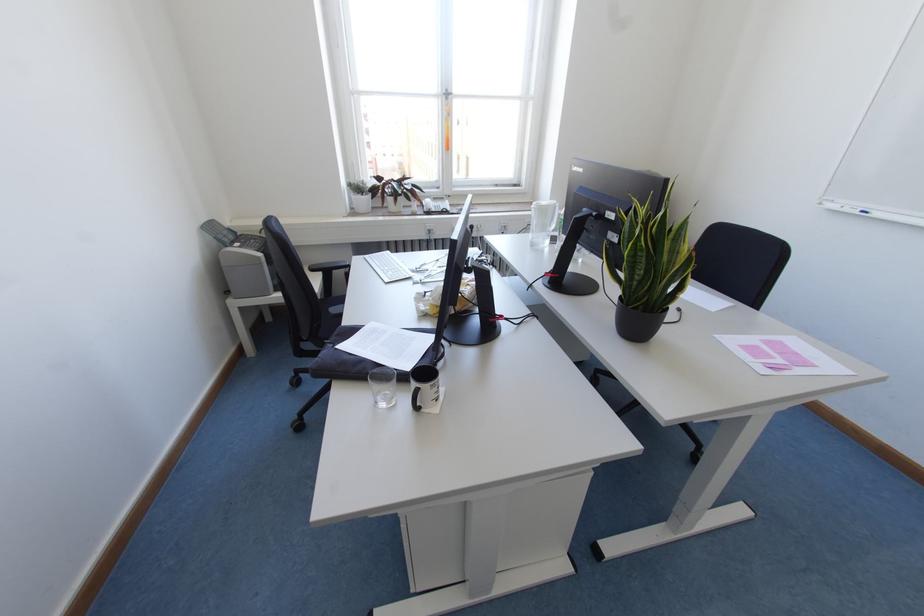
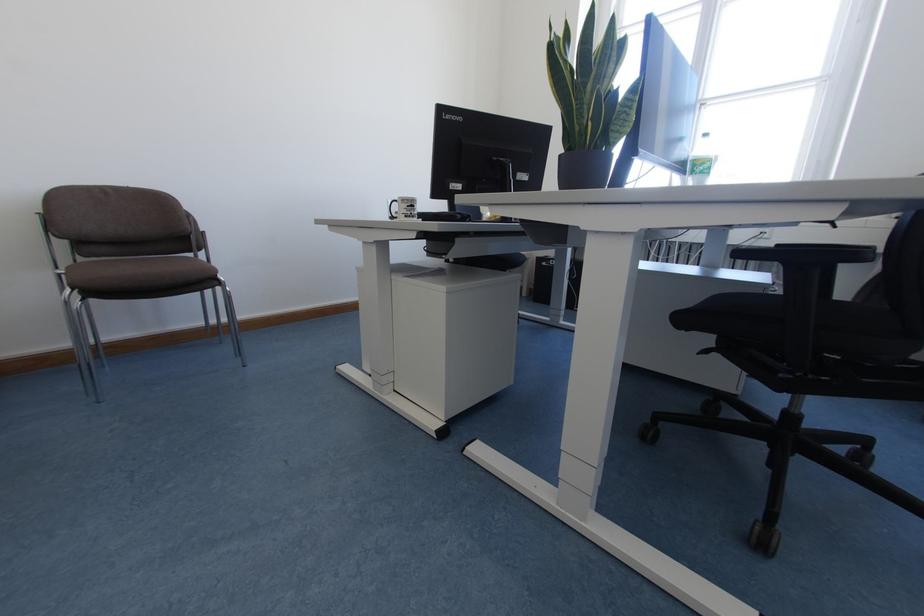
Locate, in the second image, the point that corresponds to point (435, 400) in the first image.

(405, 216)